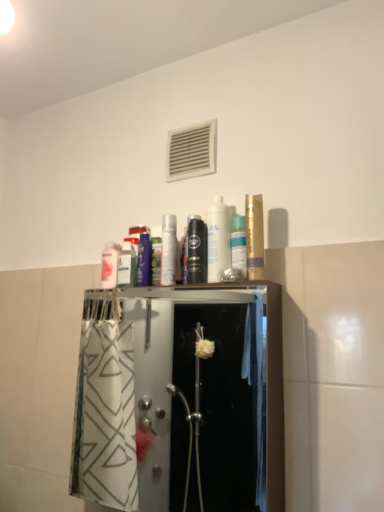
The image size is (384, 512). What do you see at coordinates (143, 255) in the screenshot? I see `purple glossy mouthwash at center, the third mouthwash when ordered from right to left` at bounding box center [143, 255].

How much space does gold metallic can at upper right, which ranks as the 3th mouthwash in left-to-right order, occupy horizontally?

gold metallic can at upper right, which ranks as the 3th mouthwash in left-to-right order, is 2.45 inches in width.

The image size is (384, 512). What do you see at coordinates (254, 237) in the screenshot? I see `gold metallic can at upper right, which ranks as the 3th mouthwash in left-to-right order` at bounding box center [254, 237].

This screenshot has height=512, width=384. What do you see at coordinates (168, 249) in the screenshot?
I see `silver metallic can at center, placed as the second toiletry when sorted from left to right` at bounding box center [168, 249].

Locate an element on the screen. This screenshot has width=384, height=512. transparent plastic shower door at center is located at coordinates (180, 400).

Locate an element on the screen. This screenshot has width=384, height=512. pink matte lotion at upper left, which is the first toiletry from left to right is located at coordinates (110, 265).

Where is `purple glossy mouthwash at center, the third mouthwash when ordered from right to left`? The image size is (384, 512). purple glossy mouthwash at center, the third mouthwash when ordered from right to left is located at coordinates (143, 255).

Is black glossy mouthwash at center, which is the second mouthwash from left to right, behind silver metallic can at center, placed as the second toiletry when sorted from left to right?

No, the depth of black glossy mouthwash at center, which is the second mouthwash from left to right, is less than that of silver metallic can at center, placed as the second toiletry when sorted from left to right.

Could you measure the distance between black glossy mouthwash at center, which ranks as the second mouthwash in right-to-left order, and silver metallic can at center, placed as the second toiletry when sorted from left to right?

black glossy mouthwash at center, which ranks as the second mouthwash in right-to-left order, and silver metallic can at center, placed as the second toiletry when sorted from left to right, are 2.89 inches apart from each other.

From the image's perspective, does black glossy mouthwash at center, which ranks as the second mouthwash in right-to-left order, appear lower than silver metallic can at center, which is the third toiletry from right to left?

Yes, from the image's perspective, black glossy mouthwash at center, which ranks as the second mouthwash in right-to-left order, is beneath silver metallic can at center, which is the third toiletry from right to left.

Considering the relative positions of purple glossy mouthwash at center, marked as the first mouthwash in a left-to-right arrangement, and white plastic vent at upper center in the image provided, is purple glossy mouthwash at center, marked as the first mouthwash in a left-to-right arrangement, in front of white plastic vent at upper center?

Yes, it is in front of white plastic vent at upper center.

Considering the sizes of purple glossy mouthwash at center, marked as the first mouthwash in a left-to-right arrangement, and white plastic vent at upper center in the image, is purple glossy mouthwash at center, marked as the first mouthwash in a left-to-right arrangement, wider or thinner than white plastic vent at upper center?

In the image, purple glossy mouthwash at center, marked as the first mouthwash in a left-to-right arrangement, appears to be wider than white plastic vent at upper center.

Is purple glossy mouthwash at center, the third mouthwash when ordered from right to left, oriented towards white plastic vent at upper center?

No, purple glossy mouthwash at center, the third mouthwash when ordered from right to left, is not facing towards white plastic vent at upper center.

Considering the sizes of objects matte white canister at center, arranged as the 3th toiletry when viewed from the left, and pink matte lotion at upper left, which is the first toiletry from left to right, in the image provided, who is wider, matte white canister at center, arranged as the 3th toiletry when viewed from the left, or pink matte lotion at upper left, which is the first toiletry from left to right,?

matte white canister at center, arranged as the 3th toiletry when viewed from the left.

Does matte white canister at center, arranged as the 3th toiletry when viewed from the left, turn towards pink matte lotion at upper left, marked as the fourth toiletry in a right-to-left arrangement?

No.

Does point (216, 261) lie behind point (106, 274)?

No, (216, 261) is closer to viewer.

Can you confirm if matte white canister at center, arranged as the 3th toiletry when viewed from the left, is taller than pink matte lotion at upper left, which is the first toiletry from left to right?

Yes.

Considering the positions of objects transparent plastic shower door at center and purple glossy mouthwash at center, marked as the first mouthwash in a left-to-right arrangement, in the image provided, who is more to the right, transparent plastic shower door at center or purple glossy mouthwash at center, marked as the first mouthwash in a left-to-right arrangement,?

transparent plastic shower door at center is more to the right.

From a real-world perspective, who is located higher, transparent plastic shower door at center or purple glossy mouthwash at center, marked as the first mouthwash in a left-to-right arrangement?

purple glossy mouthwash at center, marked as the first mouthwash in a left-to-right arrangement, is physically above.

Identify the location of closet directly beneath the purple glossy mouthwash at center, the third mouthwash when ordered from right to left (from a real-world perspective). (180, 400).

Based on the photo, considering the relative sizes of transparent plastic shower door at center and purple glossy mouthwash at center, the third mouthwash when ordered from right to left, in the image provided, is transparent plastic shower door at center bigger than purple glossy mouthwash at center, the third mouthwash when ordered from right to left,?

Yes, transparent plastic shower door at center is bigger than purple glossy mouthwash at center, the third mouthwash when ordered from right to left.

From their relative heights in the image, would you say silver metallic can at center, placed as the second toiletry when sorted from left to right, is taller or shorter than gold metallic can at upper right, which ranks as the first mouthwash in right-to-left order?

In the image, silver metallic can at center, placed as the second toiletry when sorted from left to right, appears to be shorter than gold metallic can at upper right, which ranks as the first mouthwash in right-to-left order.

From a real-world perspective, who is located lower, silver metallic can at center, which is the third toiletry from right to left, or gold metallic can at upper right, which ranks as the first mouthwash in right-to-left order?

From a 3D spatial view, silver metallic can at center, which is the third toiletry from right to left, is below.

Based on the photo, does silver metallic can at center, placed as the second toiletry when sorted from left to right, turn towards gold metallic can at upper right, which ranks as the first mouthwash in right-to-left order?

No, silver metallic can at center, placed as the second toiletry when sorted from left to right, is not oriented towards gold metallic can at upper right, which ranks as the first mouthwash in right-to-left order.

Identify the location of mouthwash above the silver metallic can at center, which is the third toiletry from right to left (from the image's perspective). The width and height of the screenshot is (384, 512). (254, 237).

Is point (243, 249) positioned behind point (206, 164)?

No, (243, 249) is in front of (206, 164).

Based on their sizes in the image, would you say translucent plastic spray can at upper center, marked as the fourth toiletry in a left-to-right arrangement, is bigger or smaller than white plastic vent at upper center?

Clearly, translucent plastic spray can at upper center, marked as the fourth toiletry in a left-to-right arrangement, is smaller in size than white plastic vent at upper center.

Which object is further away from the camera, translucent plastic spray can at upper center, the first toiletry viewed from the right, or white plastic vent at upper center?

white plastic vent at upper center is further from the camera.

Is translucent plastic spray can at upper center, marked as the fourth toiletry in a left-to-right arrangement, aimed at white plastic vent at upper center?

No, translucent plastic spray can at upper center, marked as the fourth toiletry in a left-to-right arrangement, is not oriented towards white plastic vent at upper center.

From a real-world perspective, is black glossy mouthwash at center, which ranks as the second mouthwash in right-to-left order, positioned over pink matte lotion at upper left, marked as the fourth toiletry in a right-to-left arrangement, based on gravity?

Yes.

Does point (205, 247) come behind point (110, 273)?

No, it is in front of (110, 273).

From the image's perspective, which object appears higher, black glossy mouthwash at center, which ranks as the second mouthwash in right-to-left order, or pink matte lotion at upper left, which is the first toiletry from left to right?

black glossy mouthwash at center, which ranks as the second mouthwash in right-to-left order, from the image's perspective.

You are a GUI agent. You are given a task and a screenshot of the screen. Output one action in this format:
    pyautogui.click(x=<x>, y=<y>)
    Task: Click on the mouthwash that is the 1st one when counting rightward from the silver metallic can at center, placed as the second toiletry when sorted from left to right
    Image resolution: width=384 pixels, height=512 pixels.
    Given the screenshot: What is the action you would take?
    pyautogui.click(x=196, y=250)

Where is `mouthwash on the left of white plastic vent at upper center`? mouthwash on the left of white plastic vent at upper center is located at coordinates (143, 255).

Estimate the real-world distances between objects in this image. Which object is closer to matte white canister at center, arranged as the 3th toiletry when viewed from the left, silver metallic can at center, which is the third toiletry from right to left, or white plastic vent at upper center?

Based on the image, silver metallic can at center, which is the third toiletry from right to left, appears to be nearer to matte white canister at center, arranged as the 3th toiletry when viewed from the left.

Considering their positions, is pink matte lotion at upper left, which is the first toiletry from left to right, positioned closer to transparent plastic shower door at center than gold metallic can at upper right, which ranks as the 3th mouthwash in left-to-right order?

pink matte lotion at upper left, which is the first toiletry from left to right, lies closer to transparent plastic shower door at center than the other object.

Estimate the real-world distances between objects in this image. Which object is further from black glossy mouthwash at center, which ranks as the second mouthwash in right-to-left order, matte white canister at center, arranged as the 3th toiletry when viewed from the left, or gold metallic can at upper right, which ranks as the first mouthwash in right-to-left order?

The object further to black glossy mouthwash at center, which ranks as the second mouthwash in right-to-left order, is gold metallic can at upper right, which ranks as the first mouthwash in right-to-left order.

From the image, which object appears to be nearer to gold metallic can at upper right, which ranks as the 3th mouthwash in left-to-right order, black glossy mouthwash at center, which is the second mouthwash from left to right, or pink matte lotion at upper left, marked as the fourth toiletry in a right-to-left arrangement?

Among the two, black glossy mouthwash at center, which is the second mouthwash from left to right, is located nearer to gold metallic can at upper right, which ranks as the 3th mouthwash in left-to-right order.

From the image, which object appears to be nearer to matte white canister at center, the second toiletry viewed from the right, purple glossy mouthwash at center, the third mouthwash when ordered from right to left, or transparent plastic shower door at center?

purple glossy mouthwash at center, the third mouthwash when ordered from right to left, is closer to matte white canister at center, the second toiletry viewed from the right.

Based on their spatial positions, is black glossy mouthwash at center, which is the second mouthwash from left to right, or matte white canister at center, arranged as the 3th toiletry when viewed from the left, closer to purple glossy mouthwash at center, the third mouthwash when ordered from right to left?

Among the two, black glossy mouthwash at center, which is the second mouthwash from left to right, is located nearer to purple glossy mouthwash at center, the third mouthwash when ordered from right to left.

When comparing their distances from translucent plastic spray can at upper center, the first toiletry viewed from the right, does matte white canister at center, the second toiletry viewed from the right, or transparent plastic shower door at center seem further?

The object further to translucent plastic spray can at upper center, the first toiletry viewed from the right, is transparent plastic shower door at center.

When comparing their distances from purple glossy mouthwash at center, the third mouthwash when ordered from right to left, does transparent plastic shower door at center or black glossy mouthwash at center, which ranks as the second mouthwash in right-to-left order, seem closer?

The object closer to purple glossy mouthwash at center, the third mouthwash when ordered from right to left, is black glossy mouthwash at center, which ranks as the second mouthwash in right-to-left order.

Where is `toiletry between purple glossy mouthwash at center, the third mouthwash when ordered from right to left, and matte white canister at center, arranged as the 3th toiletry when viewed from the left, in the horizontal direction`? toiletry between purple glossy mouthwash at center, the third mouthwash when ordered from right to left, and matte white canister at center, arranged as the 3th toiletry when viewed from the left, in the horizontal direction is located at coordinates (168, 249).

Identify the location of toiletry between white plastic vent at upper center and silver metallic can at center, placed as the second toiletry when sorted from left to right, in the vertical direction. (x=218, y=238).

At what (x,y) coordinates should I click in order to perform the action: click on toiletry situated between matte white canister at center, arranged as the 3th toiletry when viewed from the left, and gold metallic can at upper right, which ranks as the first mouthwash in right-to-left order, from left to right. Please return your answer as a coordinate pair (x, y). Image resolution: width=384 pixels, height=512 pixels. Looking at the image, I should click on (238, 244).

The height and width of the screenshot is (512, 384). Identify the location of mouthwash that lies between white plastic vent at upper center and translucent plastic spray can at upper center, marked as the fourth toiletry in a left-to-right arrangement, from top to bottom. (254, 237).